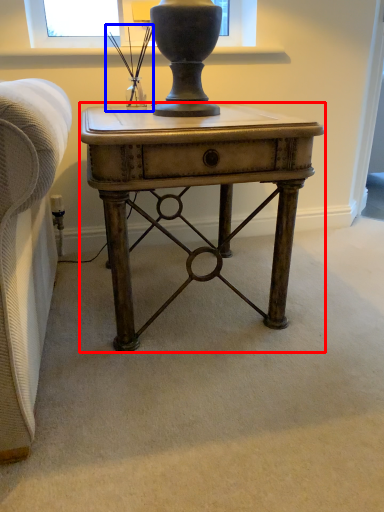
Question: Which object appears closest to the camera in this image, desk (highlighted by a red box) or table lamp (highlighted by a blue box)?

Choices:
 (A) desk
 (B) table lamp

Answer: (A)